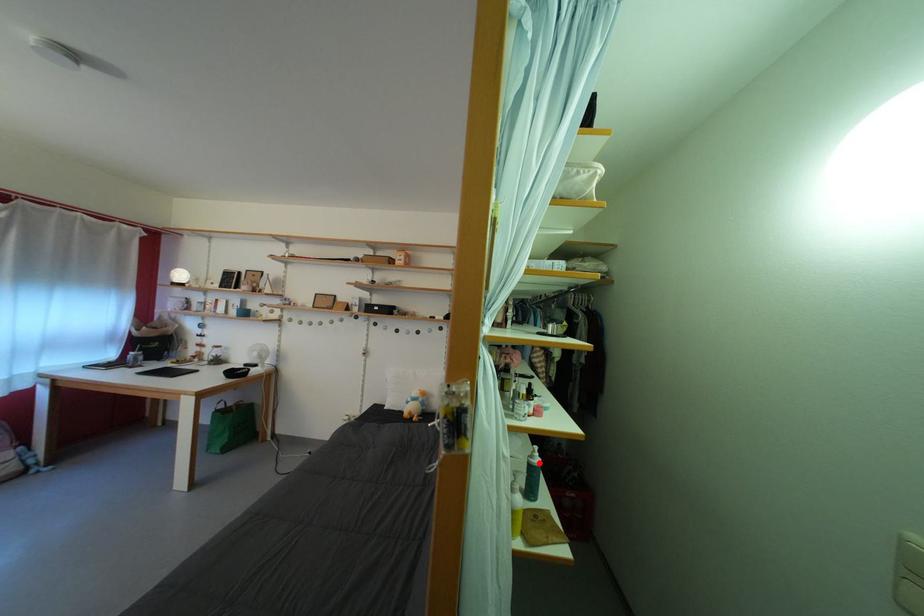
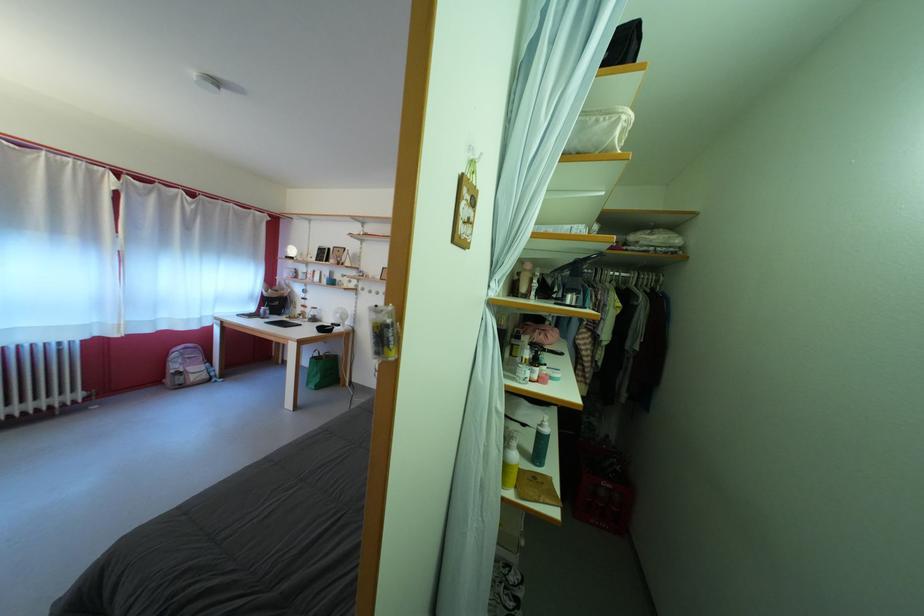
Question: I am providing you with two images of the same scene from different viewpoints. In image1, a red point is highlighted. Considering the same 3D point in image2, which of the following is correct?

Choices:
 (A) It is closer
 (B) It is farther

Answer: (A)